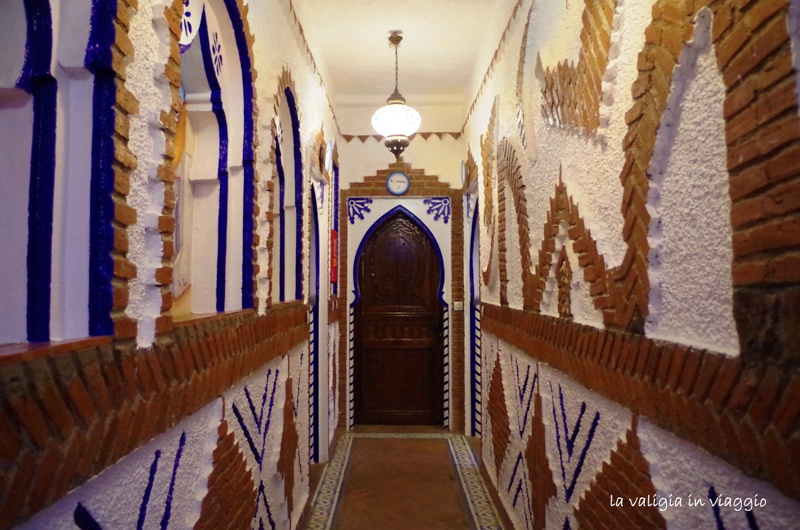
You are a GUI agent. You are given a task and a screenshot of the screen. Output one action in this format:
    pyautogui.click(x=<x>, y=<y>)
    Task: Click on the door
    This screenshot has width=800, height=530.
    Given the screenshot: What is the action you would take?
    pyautogui.click(x=406, y=286), pyautogui.click(x=408, y=323), pyautogui.click(x=409, y=390)